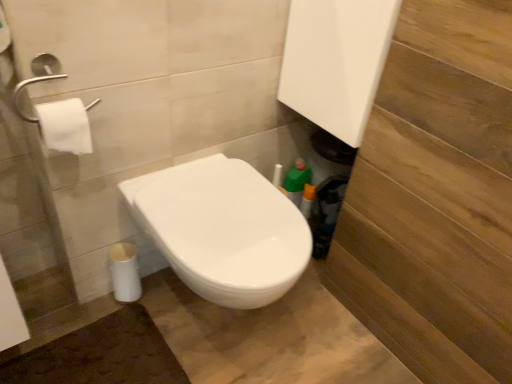
Image resolution: width=512 pixels, height=384 pixels. Find the location of `white matte toilet paper at upper left`. white matte toilet paper at upper left is located at coordinates (66, 126).

In order to face white matte toilet paper at upper left, should I rotate leftwards or rightwards?

It's best to rotate left around 23.999 degrees.

What do you see at coordinates (66, 126) in the screenshot? I see `white matte toilet paper at upper left` at bounding box center [66, 126].

Locate an element on the screen. The image size is (512, 384). white glossy toilet at center is located at coordinates click(223, 229).

The width and height of the screenshot is (512, 384). Describe the element at coordinates (223, 229) in the screenshot. I see `white glossy toilet at center` at that location.

What is the approximate height of white glossy toilet at center?

The height of white glossy toilet at center is 16.46 inches.

The image size is (512, 384). What are the coordinates of `white matte toilet paper at upper left` in the screenshot? It's located at (66, 126).

Is white matte toilet paper at upper left to the left or to the right of white glossy toilet at center in the image?

In the image, white matte toilet paper at upper left appears on the left side of white glossy toilet at center.

Which object is more forward, white matte toilet paper at upper left or white glossy toilet at center?

Positioned in front is white glossy toilet at center.

Does point (52, 138) lie in front of point (170, 168)?

Yes, point (52, 138) is in front of point (170, 168).

From the image's perspective, is white matte toilet paper at upper left located beneath white glossy toilet at center?

Actually, white matte toilet paper at upper left appears above white glossy toilet at center in the image.

From a real-world perspective, which is physically below, white matte toilet paper at upper left or white glossy toilet at center?

white glossy toilet at center.

Which of these two, white matte toilet paper at upper left or white glossy toilet at center, is wider?

With larger width is white glossy toilet at center.

Is white matte toilet paper at upper left shorter than white glossy toilet at center?

Correct, white matte toilet paper at upper left is not as tall as white glossy toilet at center.

Considering the sizes of white matte toilet paper at upper left and white glossy toilet at center in the image, is white matte toilet paper at upper left bigger or smaller than white glossy toilet at center?

In the image, white matte toilet paper at upper left appears to be smaller than white glossy toilet at center.

Can white glossy toilet at center be found inside white matte toilet paper at upper left?

No, white glossy toilet at center is not inside white matte toilet paper at upper left.

Is white matte toilet paper at upper left touching white glossy toilet at center?

white matte toilet paper at upper left is not next to white glossy toilet at center, and they're not touching.

Is white matte toilet paper at upper left facing towards white glossy toilet at center?

No, white matte toilet paper at upper left is not oriented towards white glossy toilet at center.

How distant is white matte toilet paper at upper left from white glossy toilet at center?

white matte toilet paper at upper left is 14.47 inches away from white glossy toilet at center.

Locate an element on the screen. This screenshot has height=384, width=512. toilet in front of the white matte toilet paper at upper left is located at coordinates (223, 229).

Between white glossy toilet at center and white matte toilet paper at upper left, which one appears on the right side from the viewer's perspective?

From the viewer's perspective, white glossy toilet at center appears more on the right side.

Is white glossy toilet at center in front of or behind white matte toilet paper at upper left in the image?

In the image, white glossy toilet at center appears in front of white matte toilet paper at upper left.

Which point is more distant from viewer, (192, 221) or (56, 119)?

Point (192, 221)

From the image's perspective, relative to white matte toilet paper at upper left, is white glossy toilet at center above or below?

white glossy toilet at center is situated lower than white matte toilet paper at upper left in the image.

From a real-world perspective, is white glossy toilet at center beneath white matte toilet paper at upper left?

Yes, from a real-world perspective, white glossy toilet at center is under white matte toilet paper at upper left.

Does white glossy toilet at center have a lesser width compared to white matte toilet paper at upper left?

No.

Who is shorter, white glossy toilet at center or white matte toilet paper at upper left?

white matte toilet paper at upper left is shorter.

Who is bigger, white glossy toilet at center or white matte toilet paper at upper left?

Bigger between the two is white glossy toilet at center.

Is white glossy toilet at center located outside white matte toilet paper at upper left?

Indeed, white glossy toilet at center is completely outside white matte toilet paper at upper left.

Are white glossy toilet at center and white matte toilet paper at upper left beside each other?

No, white glossy toilet at center is not next to white matte toilet paper at upper left.

Is white matte toilet paper at upper left at the back of white glossy toilet at center?

No, white glossy toilet at center is not facing the opposite direction of white matte toilet paper at upper left.

How different are the orientations of white glossy toilet at center and white matte toilet paper at upper left in degrees?

7.34 degrees.

Identify the location of toilet located below the white matte toilet paper at upper left (from the image's perspective). (223, 229).

The height and width of the screenshot is (384, 512). In the image, there is a white matte toilet paper at upper left. In order to click on toilet below it (from a real-world perspective) in this screenshot , I will do `click(223, 229)`.

In the image, there is a white glossy toilet at center. Identify the location of toilet paper above it (from the image's perspective). (66, 126).